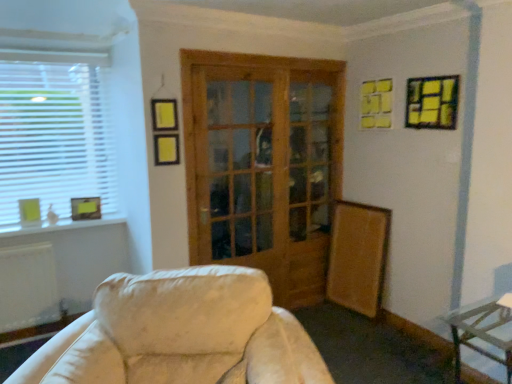
Question: From a real-world perspective, is metallic silver table at lower right above or below yellow paper picture frame at upper right, placed as the 1th picture frame when sorted from front to back?

Choices:
 (A) below
 (B) above

Answer: (A)

Question: Which is correct: metallic silver table at lower right is inside yellow paper picture frame at upper right, positioned as the third picture frame in bottom-to-top order, or outside of it?

Choices:
 (A) inside
 (B) outside

Answer: (B)

Question: Which of these objects is positioned farthest from the matte yellow picture frame at left, which is counted as the second picture frame, starting from the front?

Choices:
 (A) metallic silver table at lower right
 (B) matte yellow picture frame at lower left, which is the third picture frame from front to back
 (C) white plastic window at left
 (D) yellow paper picture frame at upper right, placed as the 1th picture frame when sorted from front to back
 (E) wooden glass door at center

Answer: (A)

Question: Considering the real-world distances, which object is closest to the metallic silver table at lower right?

Choices:
 (A) matte yellow picture frame at left, acting as the third picture frame starting from the top
 (B) white plastic window at left
 (C) wooden glass door at center
 (D) yellow paper picture frame at upper right, placed as the 1th picture frame when sorted from front to back
 (E) matte yellow picture frame at lower left, marked as the 2th picture frame in a left-to-right arrangement

Answer: (D)